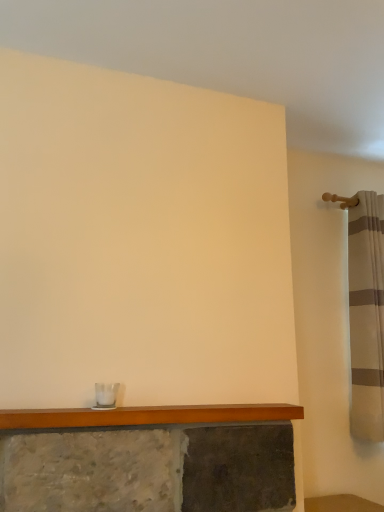
Locate an element on the screen. This screenshot has width=384, height=512. blank space above wooden mantle at lower center (from a real-world perspective) is located at coordinates (157, 407).